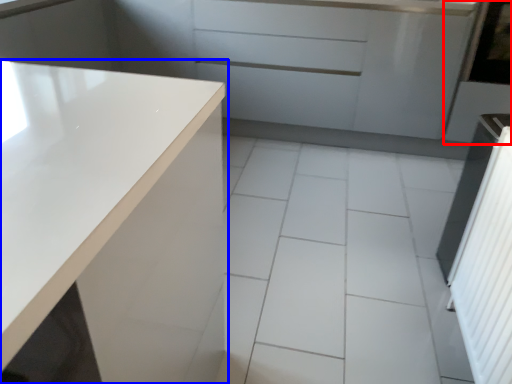
Question: Which point is further to the camera, screen door (highlighted by a red box) or countertop (highlighted by a blue box)?

Choices:
 (A) screen door
 (B) countertop

Answer: (A)